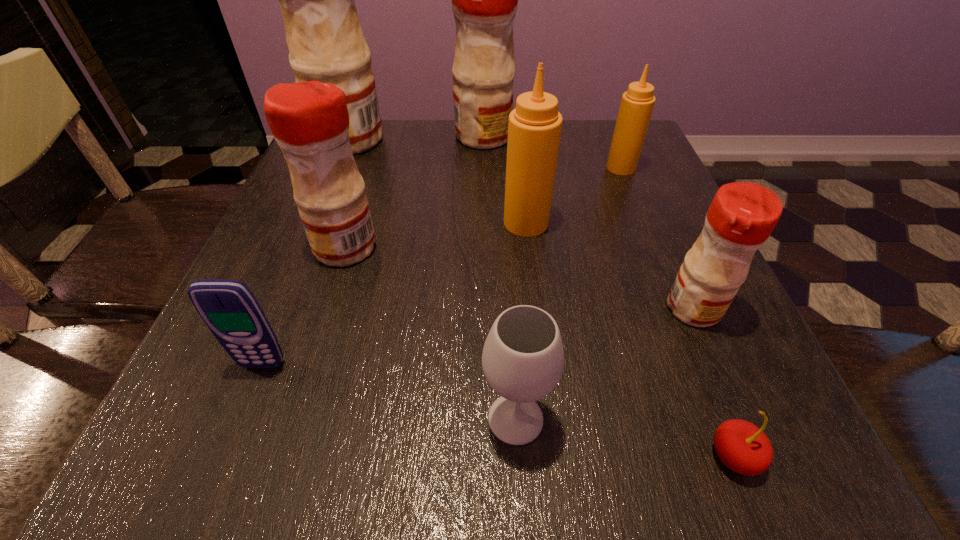
You are a GUI agent. You are given a task and a screenshot of the screen. Output one action in this format:
    pyautogui.click(x=<x>, y=<y>)
    Task: Click on the vacant area between the bigger tan condiment and the third biggest red condiment
    
    Given the screenshot: What is the action you would take?
    pyautogui.click(x=436, y=235)

The image size is (960, 540). Identify the location of free space between the second red condiment from right to left and the wineglass. (499, 278).

At what (x,y) coordinates should I click in order to perform the action: click on empty space between the left tan condiment and the fifth shortest condiment. Please return your answer as a coordinate pair (x, y). Looking at the image, I should click on (505, 180).

Where is `vacant area that lies between the cellular telephone and the third biggest red condiment`? vacant area that lies between the cellular telephone and the third biggest red condiment is located at coordinates (304, 306).

The width and height of the screenshot is (960, 540). Find the location of `vacant space that's between the rightmost red condiment and the second smallest red condiment`. vacant space that's between the rightmost red condiment and the second smallest red condiment is located at coordinates (519, 278).

Identify which object is located as the seventh nearest to the seventh farthest object. Please provide its 2D coordinates. Your answer should be formatted as a tuple, i.e. [(x, y)], where the tuple contains the x and y coordinates of a point satisfying the conditions above.

[(484, 0)]

Select which object appears as the eighth closest to the tallest object. Please provide its 2D coordinates. Your answer should be formatted as a tuple, i.e. [(x, y)], where the tuple contains the x and y coordinates of a point satisfying the conditions above.

[(744, 448)]

Where is `condiment that is the fourth closest one to the second red condiment from right to left`? This screenshot has height=540, width=960. condiment that is the fourth closest one to the second red condiment from right to left is located at coordinates (309, 120).

Identify which condiment is located as the fifth nearest to the seventh farthest object. Please provide its 2D coordinates. Your answer should be formatted as a tuple, i.e. [(x, y)], where the tuple contains the x and y coordinates of a point satisfying the conditions above.

[(484, 0)]

Identify which red condiment is located as the fourth nearest to the seventh nearest object. Please provide its 2D coordinates. Your answer should be formatted as a tuple, i.e. [(x, y)], where the tuple contains the x and y coordinates of a point satisfying the conditions above.

[(324, 36)]